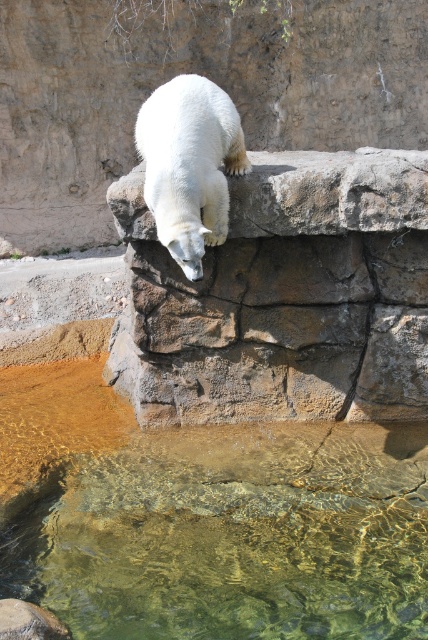
You are a zookeeper observing the polar bear in its enclosure. You notice the brown rough stone at upper center and the white fur bear at upper center. Which object occupies more space in the scene?

The brown rough stone at upper center has a larger size compared to the white fur bear at upper center, so it occupies more space in the scene.

From the picture: You are standing at the entrance of the polar bear enclosure and want to observe the bear from two specific points marked as point (300, 220) and point (205, 109). Which point allows you to see the bear first as you walk towards them?

Point (205, 109) allows you to see the bear first because it is closer to the bear than point (300, 220), which is behind it.

Consider the image. Based on the scene description, which object is wider, the clear glass water at lower center or the brown rough stone at upper center?

The clear glass water at lower center might be wider than brown rough stone at upper center according to the description.